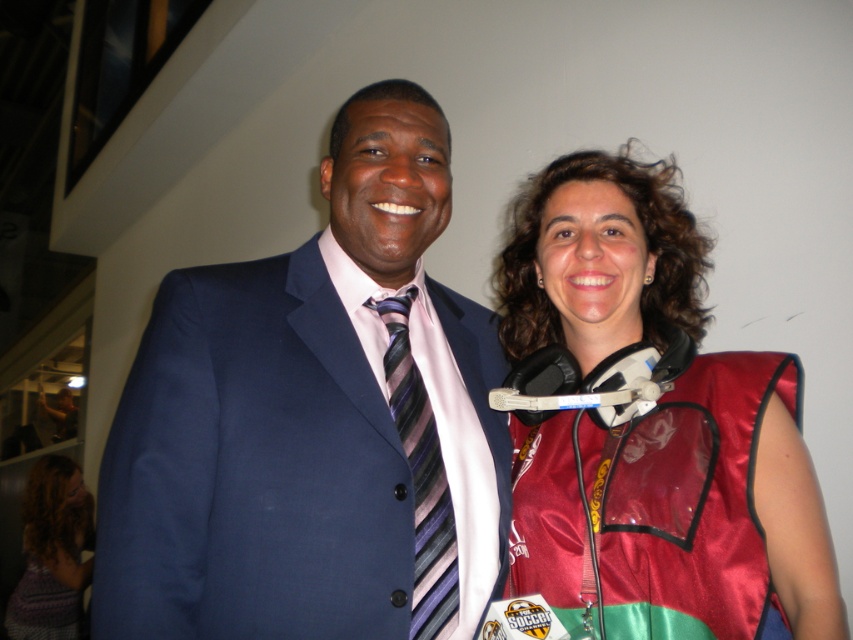
Between matte blue suit at center and knitted purple sweater at lower left, which one has less height?

With less height is matte blue suit at center.

Which is more to the left, matte blue suit at center or knitted purple sweater at lower left?

Positioned to the left is knitted purple sweater at lower left.

Between point (312, 368) and point (80, 593), which one is positioned behind?

The point (80, 593) is behind.

The image size is (853, 640). What are the coordinates of `matte blue suit at center` in the screenshot? It's located at (314, 422).

Is striped silk tie at center wider than knitted purple sweater at lower left?

Incorrect, striped silk tie at center's width does not surpass knitted purple sweater at lower left's.

Is point (427, 534) less distant than point (76, 506)?

Yes.

Is point (409, 632) less distant than point (73, 476)?

Yes.

I want to click on striped silk tie at center, so click(x=421, y=476).

Does satin red vest at right appear over striped silk tie at center?

Yes.

From the picture: Between satin red vest at right and striped silk tie at center, which one has more height?

satin red vest at right

Identify the location of satin red vest at right. This screenshot has height=640, width=853. (712, 508).

This screenshot has height=640, width=853. Find the location of `satin red vest at right`. satin red vest at right is located at coordinates (712, 508).